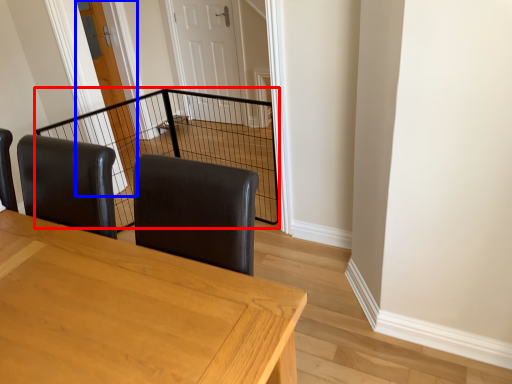
Question: Which object appears closest to the camera in this image, cage (highlighted by a red box) or door (highlighted by a blue box)?

Choices:
 (A) cage
 (B) door

Answer: (A)